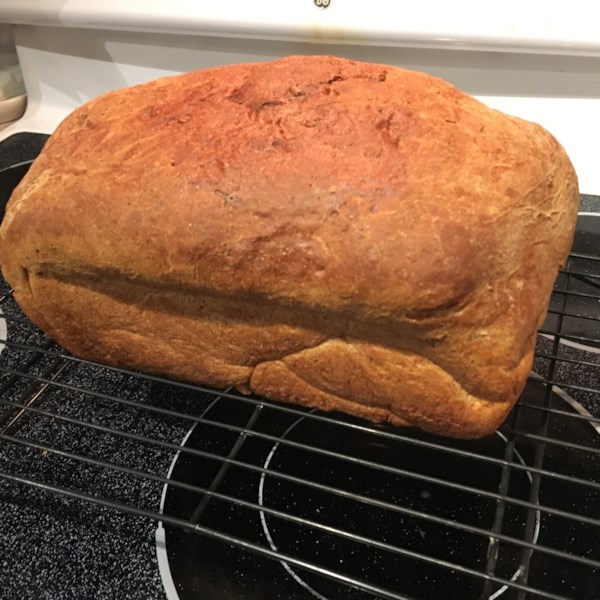
In order to click on stovetop in this screenshot , I will do `click(82, 551)`.